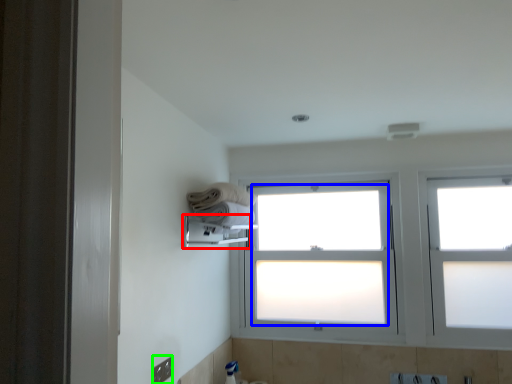
Question: Based on their relative distances, which object is nearer to towel bar (highlighted by a red box)? Choose from bay window (highlighted by a blue box) and electric outlet (highlighted by a green box).

Choices:
 (A) bay window
 (B) electric outlet

Answer: (A)